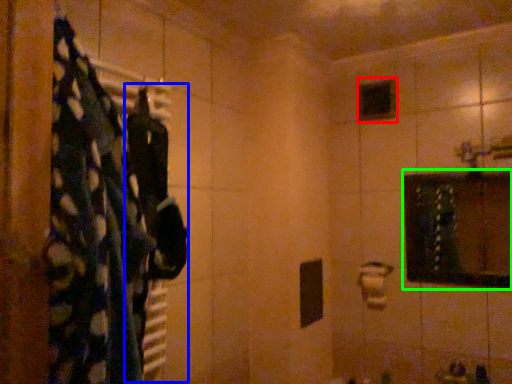
Question: Considering the real-world distances, which object is farthest from mirror (highlighted by a red box)? clothing (highlighted by a blue box) or medicine cabinet (highlighted by a green box)?

Choices:
 (A) clothing
 (B) medicine cabinet

Answer: (A)